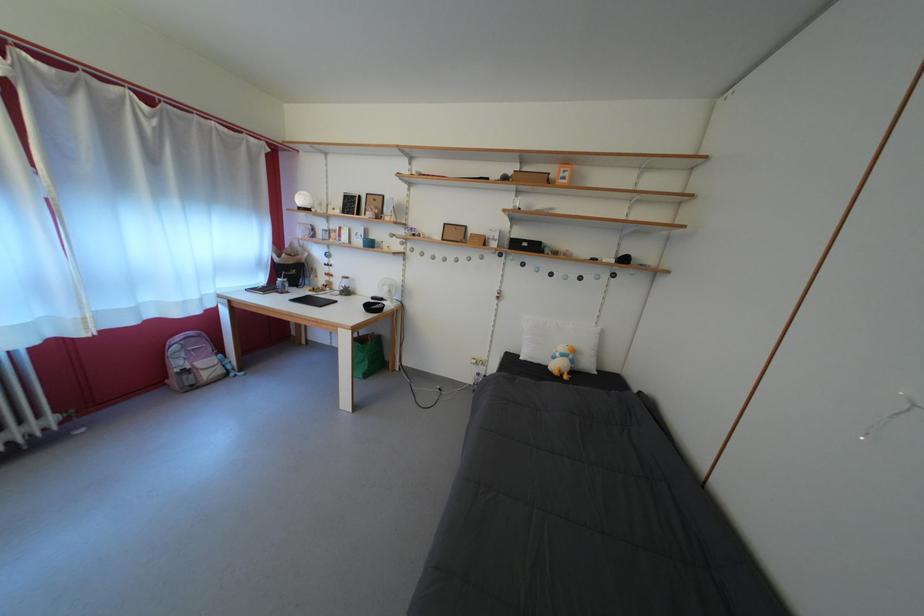
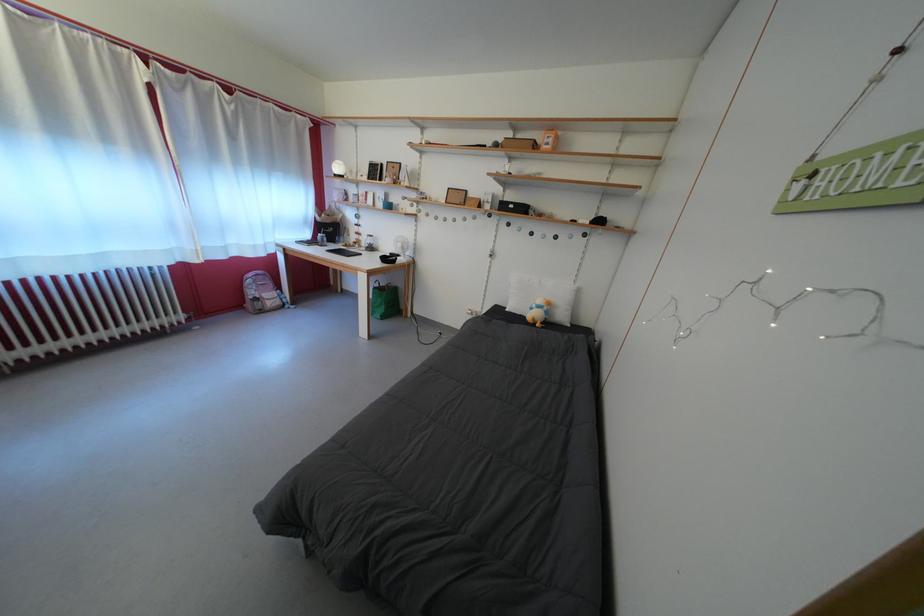
Where in the second image is the point corresponding to pixel 187 370 from the first image?

(261, 299)